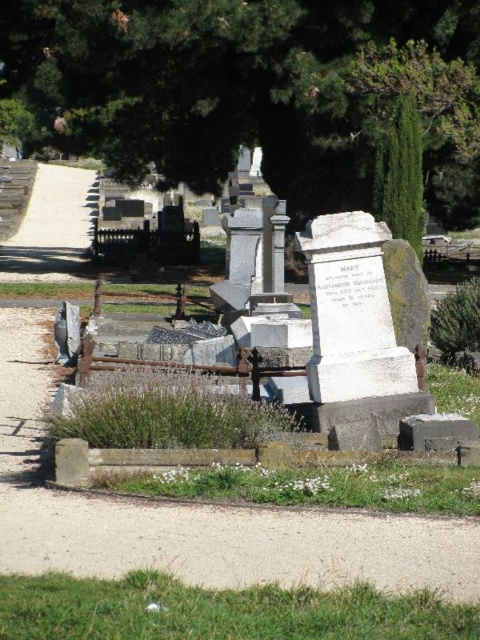
Looking at this image, is green leafy tree at upper center smaller than white marble monument at center?

Incorrect, green leafy tree at upper center is not smaller in size than white marble monument at center.

Which is in front, point (415, 68) or point (276, 266)?

Point (276, 266) is more forward.

Is point (287, 177) positioned behind point (262, 225)?

Yes, point (287, 177) is farther from viewer.

You are a GUI agent. You are given a task and a screenshot of the screen. Output one action in this format:
    pyautogui.click(x=<x>, y=<y>)
    Task: Click on the green leafy tree at upper center
    The image size is (480, 640).
    Given the screenshot: What is the action you would take?
    pyautogui.click(x=252, y=90)